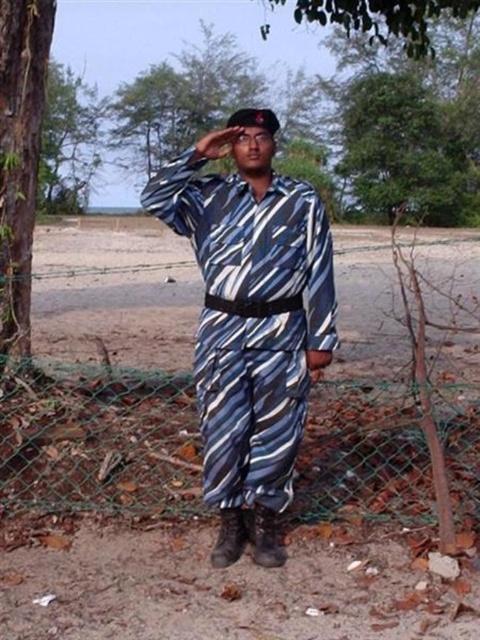
Does green wire mesh fence at lower right have a smaller size compared to green vine-covered tree at left?

Incorrect, green wire mesh fence at lower right is not smaller in size than green vine-covered tree at left.

Can you confirm if green wire mesh fence at lower right is positioned below green vine-covered tree at left?

Yes.

Describe the element at coordinates (98, 440) in the screenshot. I see `green wire mesh fence at lower right` at that location.

I want to click on green wire mesh fence at lower right, so click(98, 440).

Who is shorter, green vine-covered tree at left or green leafy tree at upper left?

green vine-covered tree at left is shorter.

Is green vine-covered tree at left to the right of green leafy tree at upper left from the viewer's perspective?

Indeed, green vine-covered tree at left is positioned on the right side of green leafy tree at upper left.

Which is behind, point (16, 108) or point (49, 88)?

The point (49, 88) is more distant.

Image resolution: width=480 pixels, height=640 pixels. What are the coordinates of `green vine-covered tree at left` in the screenshot? It's located at (20, 156).

Does blue striped uniform at center have a lesser height compared to green vine-covered tree at left?

Yes.

Which of these two, blue striped uniform at center or green vine-covered tree at left, stands taller?

green vine-covered tree at left is taller.

Is point (311, 196) closer to camera compared to point (43, 51)?

Yes.

Locate an element on the screen. This screenshot has width=480, height=640. blue striped uniform at center is located at coordinates (251, 321).